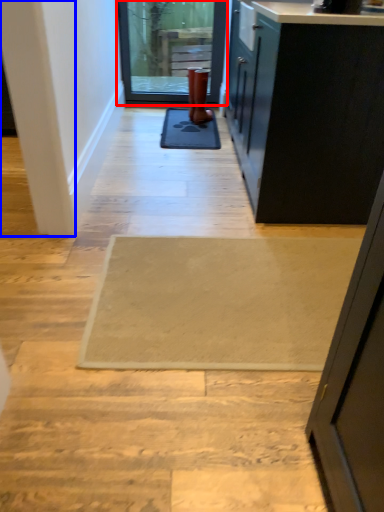
Question: Which object appears closest to the camera in this image, door (highlighted by a red box) or pillar (highlighted by a blue box)?

Choices:
 (A) door
 (B) pillar

Answer: (B)